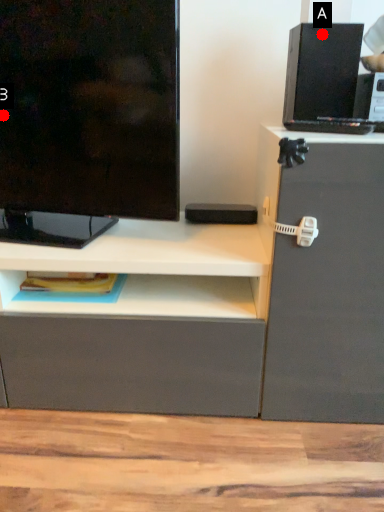
Question: Two points are circled on the image, labeled by A and B beside each circle. Which point is farther from the camera taking this photo?

Choices:
 (A) A is further
 (B) B is further

Answer: (B)